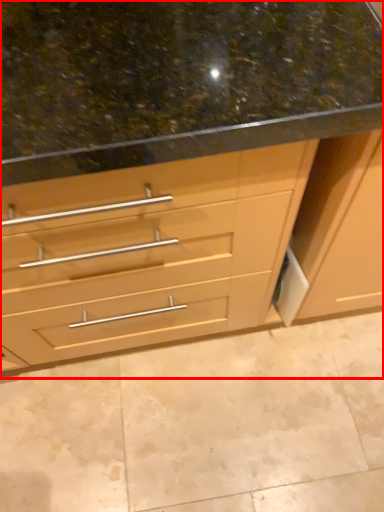
Question: From the image's perspective, what is the correct spatial positioning of cabinetry (annotated by the red box) in reference to granite?

Choices:
 (A) below
 (B) above

Answer: (B)